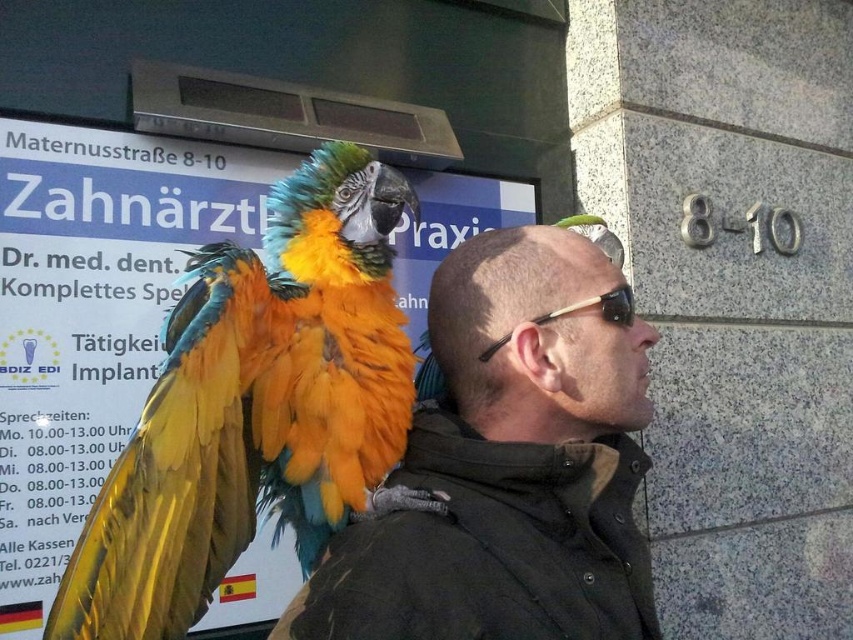
Who is more forward, [587,259] or [548,317]?

Point [548,317]

Does shiny black sunglasses at center have a greater height compared to black acetate sunglasses at upper center?

Yes, shiny black sunglasses at center is taller than black acetate sunglasses at upper center.

Is point (505, 284) in front of point (621, 321)?

No, (505, 284) is behind (621, 321).

This screenshot has height=640, width=853. In order to click on shiny black sunglasses at center in this screenshot , I will do `click(537, 337)`.

Can you confirm if shiny multicolored parrot at center is taller than shiny black sunglasses at center?

Yes.

Does point (407, 184) come farther from viewer compared to point (553, 330)?

Yes, point (407, 184) is behind point (553, 330).

Identify the location of shiny multicolored parrot at center. click(x=258, y=406).

Where is `shiny multicolored parrot at center`? shiny multicolored parrot at center is located at coordinates (258, 406).

Who is positioned more to the right, shiny multicolored parrot at center or black acetate sunglasses at upper center?

black acetate sunglasses at upper center is more to the right.

Who is more forward, (402, 352) or (483, 356)?

Point (483, 356) is more forward.

This screenshot has height=640, width=853. Find the location of `shiny multicolored parrot at center`. shiny multicolored parrot at center is located at coordinates (258, 406).